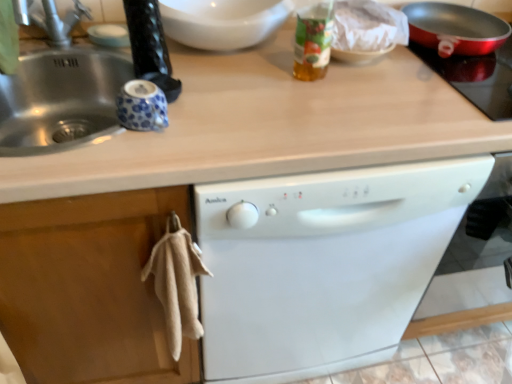
Where is `vacant space to the left of translucent plastic bottle at upper center`? Image resolution: width=512 pixels, height=384 pixels. vacant space to the left of translucent plastic bottle at upper center is located at coordinates (243, 79).